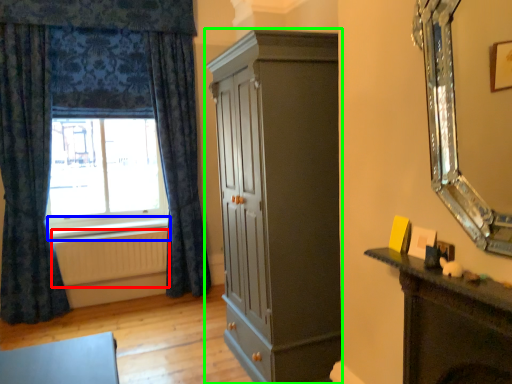
Question: Based on their relative distances, which object is farther from radiator (highlighted by a red box)? Choose from window sill (highlighted by a blue box) and cupboard (highlighted by a green box).

Choices:
 (A) window sill
 (B) cupboard

Answer: (B)